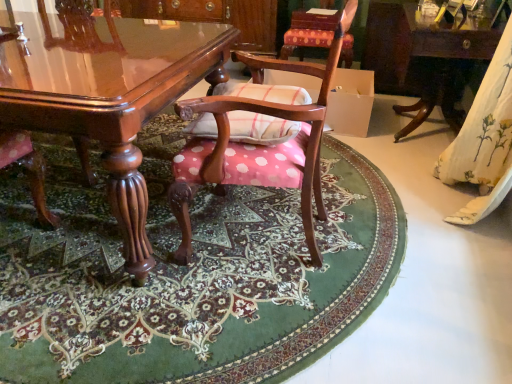
Measure the distance between white floral fabric at right and camera.

white floral fabric at right is 5.54 feet away from camera.

What is the approximate height of pink polka dot fabric at center?

It is 2.41 inches.

This screenshot has width=512, height=384. What do you see at coordinates (259, 145) in the screenshot? I see `polka dot fabric chair at center, the 1th chair ordered from the bottom` at bounding box center [259, 145].

The image size is (512, 384). What do you see at coordinates (106, 94) in the screenshot? I see `glossy wood table at center, which is the 1th table from left to right` at bounding box center [106, 94].

I want to click on wooden table at right, which is the second table in left-to-right order, so click(441, 60).

From the image's perspective, is pink polka dot fabric at center below polka dot fabric chair at center, which ranks as the second chair in back-to-front order?

Yes, from the image's perspective, pink polka dot fabric at center is beneath polka dot fabric chair at center, which ranks as the second chair in back-to-front order.

Is pink polka dot fabric at center facing towards polka dot fabric chair at center, the first chair from the front?

No, pink polka dot fabric at center is not oriented towards polka dot fabric chair at center, the first chair from the front.

Consider the image. Could you measure the distance between pink polka dot fabric at center and polka dot fabric chair at center, the 1th chair ordered from the bottom?

A distance of 15.82 inches exists between pink polka dot fabric at center and polka dot fabric chair at center, the 1th chair ordered from the bottom.

Does wooden table at right, which ranks as the 1th table in right-to-left order, appear on the right side of plaid fabric pillow at center?

Yes, wooden table at right, which ranks as the 1th table in right-to-left order, is to the right of plaid fabric pillow at center.

Is wooden table at right, which is the second table in left-to-right order, completely or partially outside of plaid fabric pillow at center?

Yes, wooden table at right, which is the second table in left-to-right order, is outside of plaid fabric pillow at center.

Between wooden table at right, which is the second table in left-to-right order, and plaid fabric pillow at center, which one has more height?

wooden table at right, which is the second table in left-to-right order.

From a real-world perspective, who is located lower, wooden table at right, which ranks as the 1th table in right-to-left order, or plaid fabric pillow at center?

wooden table at right, which ranks as the 1th table in right-to-left order, is physically lower.

This screenshot has height=384, width=512. What are the coordinates of `chair below the glossy wood table at center, the second table viewed from the right (from the image's perspective)` in the screenshot? It's located at (259, 145).

From the image's perspective, does polka dot fabric chair at center, the first chair from the front, appear higher than glossy wood table at center, which is the 1th table from left to right?

Actually, polka dot fabric chair at center, the first chair from the front, appears below glossy wood table at center, which is the 1th table from left to right, in the image.

Is there a large distance between polka dot fabric chair at center, arranged as the 2th chair when viewed from the top, and glossy wood table at center, the second table viewed from the right?

polka dot fabric chair at center, arranged as the 2th chair when viewed from the top, is near glossy wood table at center, the second table viewed from the right, not far away.

Is polka dot fabric chair at center, the first chair from the top, oriented away from polka dot fabric chair at center, which ranks as the second chair in back-to-front order?

No, polka dot fabric chair at center, the first chair from the top,'s orientation is not away from polka dot fabric chair at center, which ranks as the second chair in back-to-front order.

Does polka dot fabric chair at center, which is counted as the 1th chair, starting from the back, have a smaller size compared to polka dot fabric chair at center, arranged as the 2th chair when viewed from the top?

Yes.

Is polka dot fabric chair at center, acting as the 2th chair starting from the bottom, situated inside polka dot fabric chair at center, the 1th chair ordered from the bottom, or outside?

polka dot fabric chair at center, acting as the 2th chair starting from the bottom, exists outside the volume of polka dot fabric chair at center, the 1th chair ordered from the bottom.

Measure the distance from polka dot fabric chair at center, the first chair from the top, to polka dot fabric chair at center, which ranks as the second chair in back-to-front order.

They are 1.67 meters apart.

Is glossy wood table at center, the second table viewed from the right, in contact with polka dot fabric chair at center, acting as the 2th chair starting from the bottom?

No.

Is glossy wood table at center, the second table viewed from the right, further to camera compared to polka dot fabric chair at center, acting as the 2th chair starting from the bottom?

No, it is not.

Does glossy wood table at center, which is the 1th table from left to right, contain polka dot fabric chair at center, acting as the 2th chair starting from the bottom?

Definitely not — polka dot fabric chair at center, acting as the 2th chair starting from the bottom, is not inside glossy wood table at center, which is the 1th table from left to right.

From a real-world perspective, is glossy wood table at center, the second table viewed from the right, located higher than polka dot fabric chair at center, acting as the 2th chair starting from the front?

Incorrect, from a real-world perspective, glossy wood table at center, the second table viewed from the right, is lower than polka dot fabric chair at center, acting as the 2th chair starting from the front.

Measure the distance between wooden table at right, which is the second table in left-to-right order, and white floral fabric at right.

wooden table at right, which is the second table in left-to-right order, is 34.96 inches away from white floral fabric at right.

Looking at this image, is wooden table at right, which ranks as the 1th table in right-to-left order, facing away from white floral fabric at right?

wooden table at right, which ranks as the 1th table in right-to-left order, does not have its back to white floral fabric at right.

Based on their sizes in the image, would you say wooden table at right, which is the second table in left-to-right order, is bigger or smaller than white floral fabric at right?

Considering their sizes, wooden table at right, which is the second table in left-to-right order, takes up more space than white floral fabric at right.

Is polka dot fabric chair at center, which ranks as the second chair in back-to-front order, beside wooden table at right, which is the second table in left-to-right order?

polka dot fabric chair at center, which ranks as the second chair in back-to-front order, is not next to wooden table at right, which is the second table in left-to-right order, and they're not touching.

Considering the positions of point (313, 179) and point (444, 50), is point (313, 179) closer or farther from the camera than point (444, 50)?

Point (313, 179).

Is polka dot fabric chair at center, the first chair from the front, taller than wooden table at right, which is the second table in left-to-right order?

Yes.

Find the location of a particular element. mat that appears on the left of polka dot fabric chair at center, which ranks as the second chair in back-to-front order is located at coordinates (190, 275).

Locate an element on the screen. table that is above the plaid fabric pillow at center (from the image's perspective) is located at coordinates (441, 60).

Based on their spatial positions, is polka dot fabric chair at center, acting as the 2th chair starting from the bottom, or glossy wood table at center, which is the 1th table from left to right, closer to plaid fabric pillow at center?

Based on the image, glossy wood table at center, which is the 1th table from left to right, appears to be nearer to plaid fabric pillow at center.

From the image, which object appears to be nearer to wooden table at right, which is the second table in left-to-right order, polka dot fabric chair at center, the first chair from the top, or polka dot fabric chair at center, the 1th chair ordered from the bottom?

polka dot fabric chair at center, the first chair from the top, is closer to wooden table at right, which is the second table in left-to-right order.

Which object lies nearer to the anchor point polka dot fabric chair at center, which is counted as the 1th chair, starting from the back, glossy wood table at center, which is the 1th table from left to right, or polka dot fabric chair at center, arranged as the 2th chair when viewed from the top?

polka dot fabric chair at center, arranged as the 2th chair when viewed from the top, is closer to polka dot fabric chair at center, which is counted as the 1th chair, starting from the back.

From the image, which object appears to be farther from plaid fabric pillow at center, wooden table at right, which ranks as the 1th table in right-to-left order, or polka dot fabric chair at center, the 1th chair ordered from the bottom?

wooden table at right, which ranks as the 1th table in right-to-left order, is further to plaid fabric pillow at center.

Based on their spatial positions, is polka dot fabric chair at center, which ranks as the second chair in back-to-front order, or glossy wood table at center, which is the 1th table from left to right, further from polka dot fabric chair at center, which is counted as the 1th chair, starting from the back?

glossy wood table at center, which is the 1th table from left to right, lies further to polka dot fabric chair at center, which is counted as the 1th chair, starting from the back, than the other object.

Looking at the image, which one is located further to polka dot fabric chair at center, arranged as the 2th chair when viewed from the top, glossy wood table at center, which is the 1th table from left to right, or polka dot fabric chair at center, which is counted as the 1th chair, starting from the back?

The object further to polka dot fabric chair at center, arranged as the 2th chair when viewed from the top, is polka dot fabric chair at center, which is counted as the 1th chair, starting from the back.

Looking at the image, which one is located closer to polka dot fabric chair at center, the first chair from the front, polka dot fabric chair at center, the first chair from the top, or pink polka dot fabric at center?

Based on the image, pink polka dot fabric at center appears to be nearer to polka dot fabric chair at center, the first chair from the front.

When comparing their distances from white floral fabric at right, does wooden table at right, which ranks as the 1th table in right-to-left order, or glossy wood table at center, which is the 1th table from left to right, seem further?

Based on the image, glossy wood table at center, which is the 1th table from left to right, appears to be further to white floral fabric at right.

Identify the location of pillow between polka dot fabric chair at center, arranged as the 2th chair when viewed from the top, and polka dot fabric chair at center, acting as the 2th chair starting from the front, along the z-axis. (260, 128).

Identify the location of pillow located between pink polka dot fabric at center and wooden table at right, which is the second table in left-to-right order, in the left-right direction. (260, 128).

Locate an element on the screen. pillow between glossy wood table at center, the second table viewed from the right, and polka dot fabric chair at center, the first chair from the front, from left to right is located at coordinates tap(260, 128).

At what (x,y) coordinates should I click in order to perform the action: click on curtain located between plaid fabric pillow at center and wooden table at right, which ranks as the 1th table in right-to-left order, in the left-right direction. Please return your answer as a coordinate pair (x, y). The height and width of the screenshot is (384, 512). Looking at the image, I should click on (484, 140).